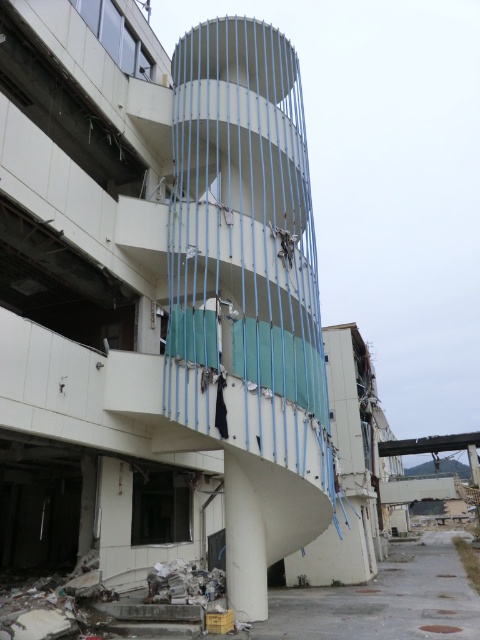
Question: Is the position of white plastic scaffolding at center more distant than that of broken concrete rubble at lower center?

Choices:
 (A) yes
 (B) no

Answer: (A)

Question: Is white plastic scaffolding at center positioned behind broken concrete rubble at lower center?

Choices:
 (A) yes
 (B) no

Answer: (A)

Question: Is white plastic scaffolding at center positioned behind broken concrete rubble at lower center?

Choices:
 (A) yes
 (B) no

Answer: (A)